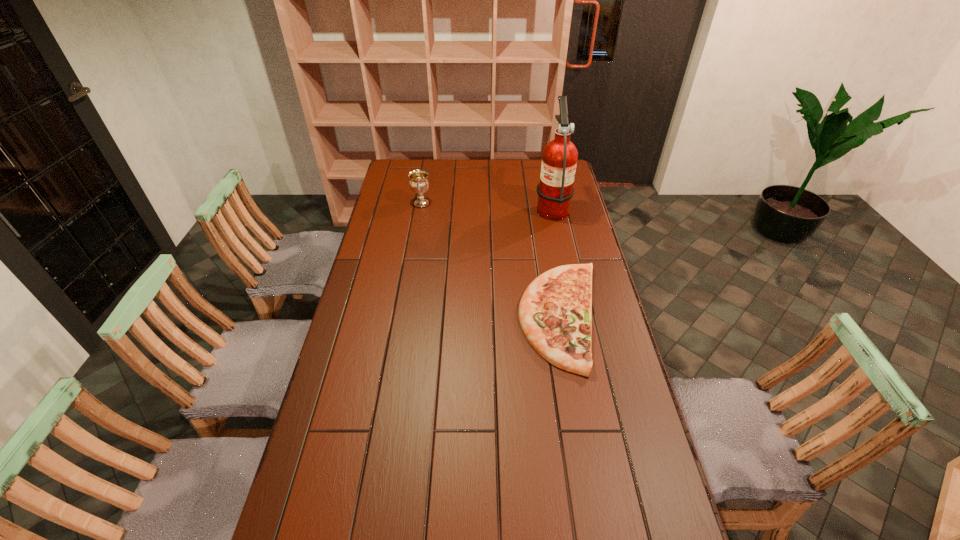
Identify which object is the nearest to the shortest object. Please provide its 2D coordinates. Your answer should be formatted as a tuple, i.e. [(x, y)], where the tuple contains the x and y coordinates of a point satisfying the conditions above.

[(555, 190)]

Where is `object identified as the second closest to the fire extinguisher`? The image size is (960, 540). object identified as the second closest to the fire extinguisher is located at coordinates (419, 183).

The width and height of the screenshot is (960, 540). Find the location of `free space that satisfies the following two spatial constraints: 1. on the front side of the pizza; 2. on the right side of the second tallest object`. free space that satisfies the following two spatial constraints: 1. on the front side of the pizza; 2. on the right side of the second tallest object is located at coordinates (402, 316).

Locate an element on the screen. The width and height of the screenshot is (960, 540). vacant region that satisfies the following two spatial constraints: 1. on the nozzle and handle of the tallest object; 2. on the front side of the pizza is located at coordinates (575, 316).

You are a GUI agent. You are given a task and a screenshot of the screen. Output one action in this format:
    pyautogui.click(x=<x>, y=<y>)
    Task: Click on the vacant space that satisfies the following two spatial constraints: 1. on the front side of the nearest object; 2. on the right side of the leftmost object
    This screenshot has width=960, height=540.
    Given the screenshot: What is the action you would take?
    pyautogui.click(x=402, y=316)